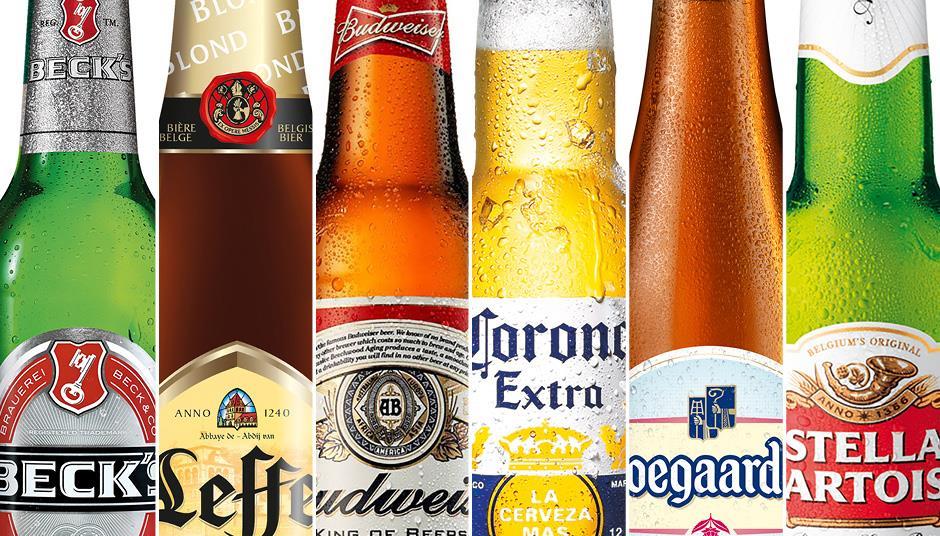
Locate an element on the screen. Image resolution: width=940 pixels, height=536 pixels. beer bottle is located at coordinates (76, 293), (213, 270), (406, 266), (521, 247), (719, 258), (851, 271).